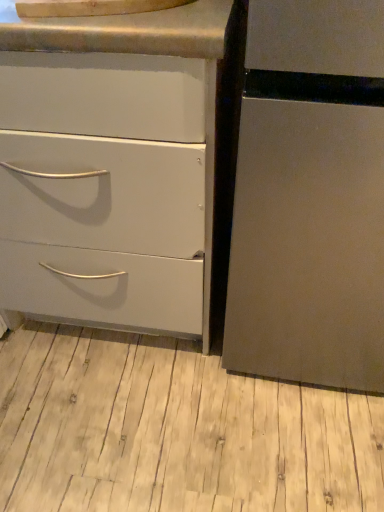
Image resolution: width=384 pixels, height=512 pixels. In order to click on free space above light wood floor at lower center (from a real-world perspective) in this screenshot , I will do `click(160, 404)`.